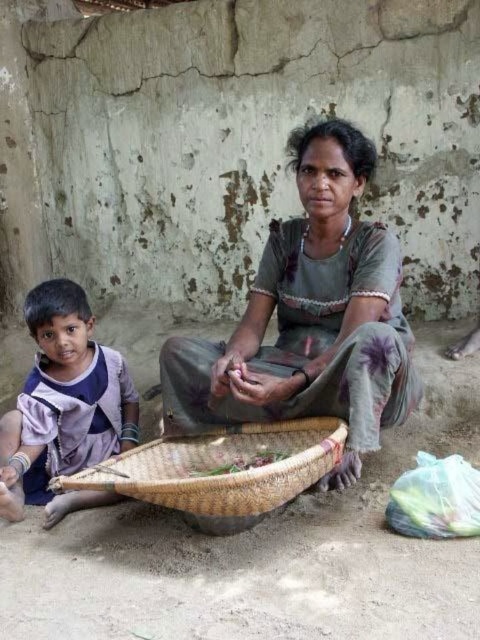
Between light purple fabric at lower left and woven brown basket at lower center, which one is positioned higher?

light purple fabric at lower left is higher up.

Can you confirm if light purple fabric at lower left is positioned above woven brown basket at lower center?

Correct, light purple fabric at lower left is located above woven brown basket at lower center.

The width and height of the screenshot is (480, 640). I want to click on light purple fabric at lower left, so click(64, 396).

Can you confirm if gray fabric dress at center is shorter than light purple fabric at lower left?

No.

Looking at this image, between gray fabric dress at center and light purple fabric at lower left, which one has less height?

light purple fabric at lower left is shorter.

Is point (180, 349) more distant than point (98, 352)?

No, it is not.

Find the location of a particular element. gray fabric dress at center is located at coordinates (310, 317).

Can you confirm if gray fabric dress at center is taller than woven brown basket at lower center?

Indeed, gray fabric dress at center has a greater height compared to woven brown basket at lower center.

Which is below, gray fabric dress at center or woven brown basket at lower center?

woven brown basket at lower center

Measure the distance between gray fabric dress at center and camera.

gray fabric dress at center is 6.20 feet from camera.

Where is `gray fabric dress at center`? Image resolution: width=480 pixels, height=640 pixels. gray fabric dress at center is located at coordinates (310, 317).